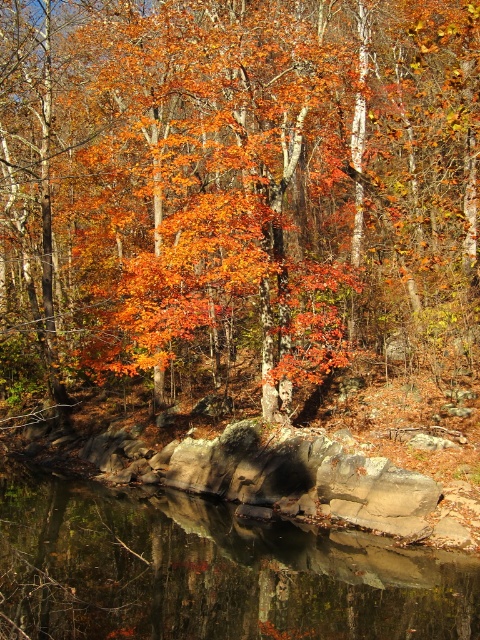
You are standing at the edge of the forest and see the orange leafy tree at center and the smooth reflective water at center. Which object appears wider from your viewpoint?

The orange leafy tree at center appears wider because its width is larger than that of the smooth reflective water at center.

You are standing at the edge of the forest and see the orange leafy tree at center and the smooth reflective water at center. Which object is positioned to the left when viewed from your perspective?

The orange leafy tree at center is positioned to the left of the smooth reflective water at center from your perspective.